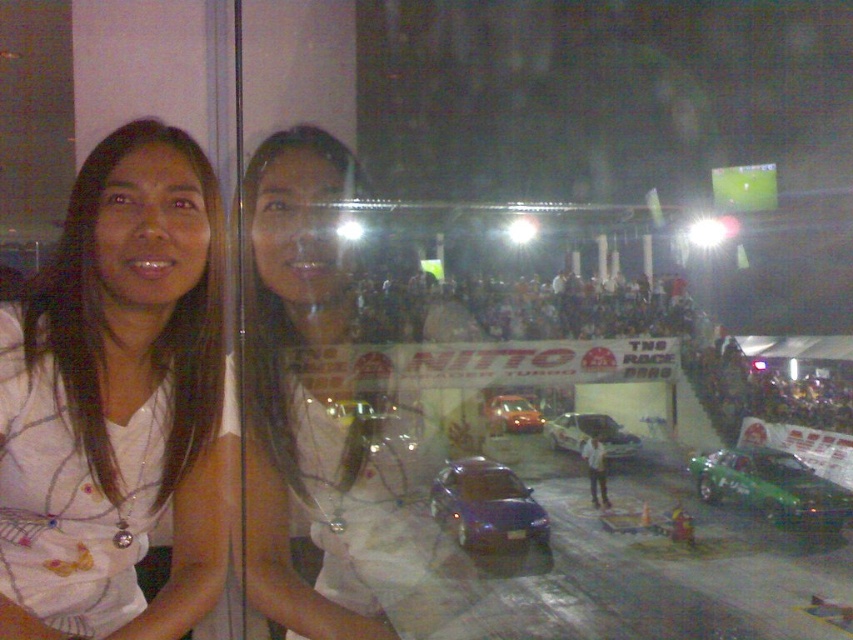
Who is shorter, white fabric shirt at left or shiny orange car at center?

With less height is white fabric shirt at left.

Is point (196, 412) positioned in front of point (537, 417)?

Yes, point (196, 412) is in front of point (537, 417).

Locate an element on the screen. white fabric shirt at left is located at coordinates (138, 342).

Can you confirm if white fabric shirt at center is positioned to the left of shiny orange car at center?

Indeed, white fabric shirt at center is positioned on the left side of shiny orange car at center.

Can you confirm if white fabric shirt at center is wider than shiny orange car at center?

Yes.

Does point (274, 556) lie in front of point (494, 403)?

Yes, point (274, 556) is closer to viewer.

In order to click on white fabric shirt at center in this screenshot , I will do `click(323, 416)`.

Is green glossy car at lower right positioned in front of shiny silver car at center?

Yes, it is.

Who is taller, green glossy car at lower right or shiny silver car at center?

Standing taller between the two is green glossy car at lower right.

Is point (780, 456) positioned in front of point (598, 426)?

Yes, point (780, 456) is closer to viewer.

Identify the location of green glossy car at lower right. (770, 486).